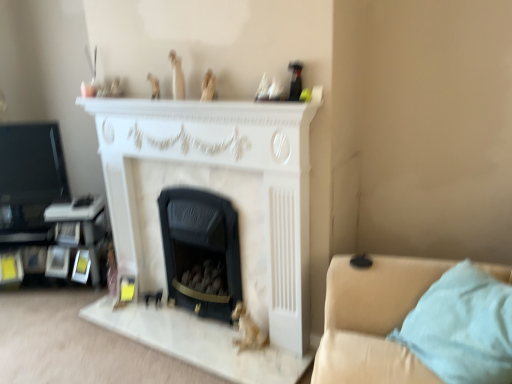
Where is `vacant space situated on the left part of gold metallic figurine at lower center, which is the fourth toy from top to bottom`? This screenshot has width=512, height=384. vacant space situated on the left part of gold metallic figurine at lower center, which is the fourth toy from top to bottom is located at coordinates (216, 354).